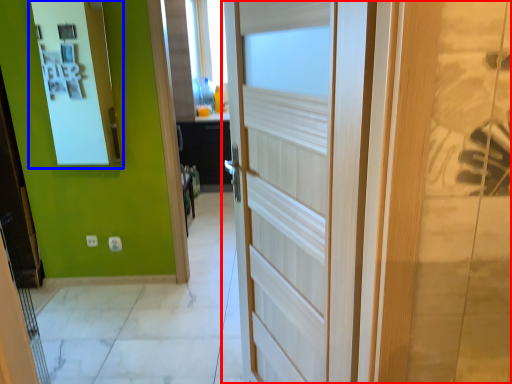
Question: Among these objects, which one is nearest to the camera, door (highlighted by a red box) or medicine cabinet (highlighted by a blue box)?

Choices:
 (A) door
 (B) medicine cabinet

Answer: (A)